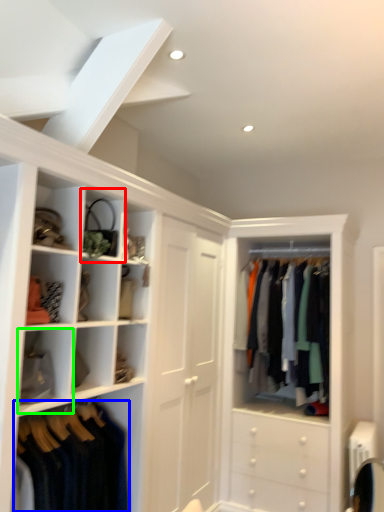
Question: Which is nearer to the cabinet (highlighted by a red box)? clothing (highlighted by a blue box) or cabinet (highlighted by a green box).

Choices:
 (A) clothing
 (B) cabinet

Answer: (B)